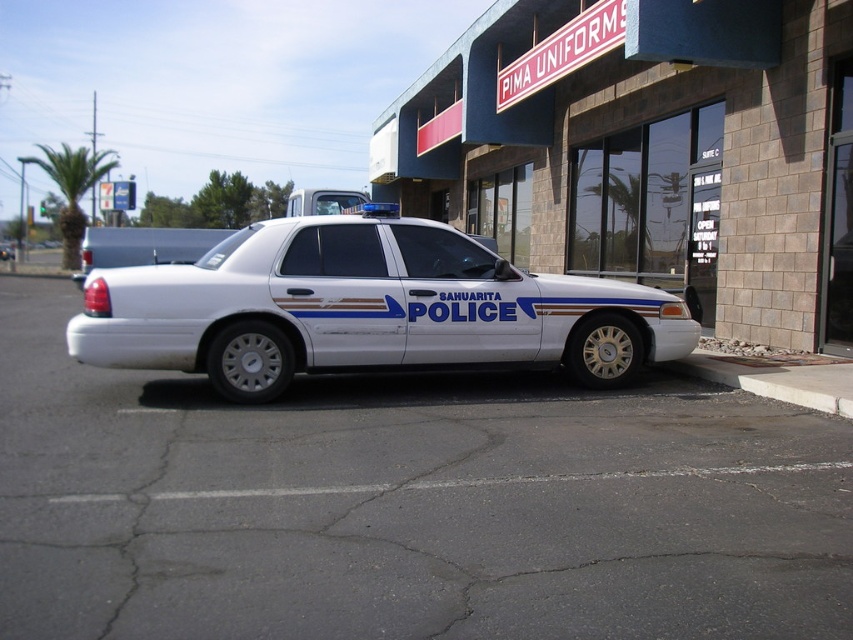
Who is taller, white metallic police car at center or white concrete curb at lower right?

white metallic police car at center

Is white metallic police car at center wider than white concrete curb at lower right?

In fact, white metallic police car at center might be narrower than white concrete curb at lower right.

Does point (83, 328) come closer to viewer compared to point (822, 404)?

Yes, it is.

What are the coordinates of `white metallic police car at center` in the screenshot? It's located at (367, 308).

Who is more forward, (811,385) or (751,385)?

Point (811,385) is more forward.

Describe the element at coordinates (778, 380) in the screenshot. I see `concrete at lower right` at that location.

Locate an element on the screen. The width and height of the screenshot is (853, 640). concrete at lower right is located at coordinates (778, 380).

Does point (474, 282) come in front of point (817, 385)?

No.

Consider the image. Is the position of white metallic police car at center more distant than that of concrete at lower right?

Yes, white metallic police car at center is behind concrete at lower right.

Is point (294, 349) behind point (838, 403)?

Yes, it is.

I want to click on white metallic police car at center, so click(x=367, y=308).